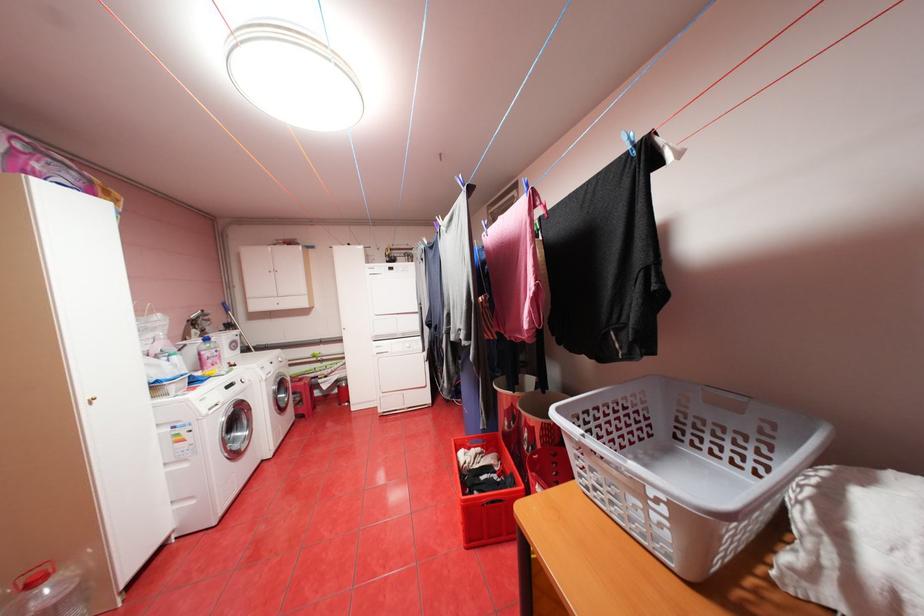
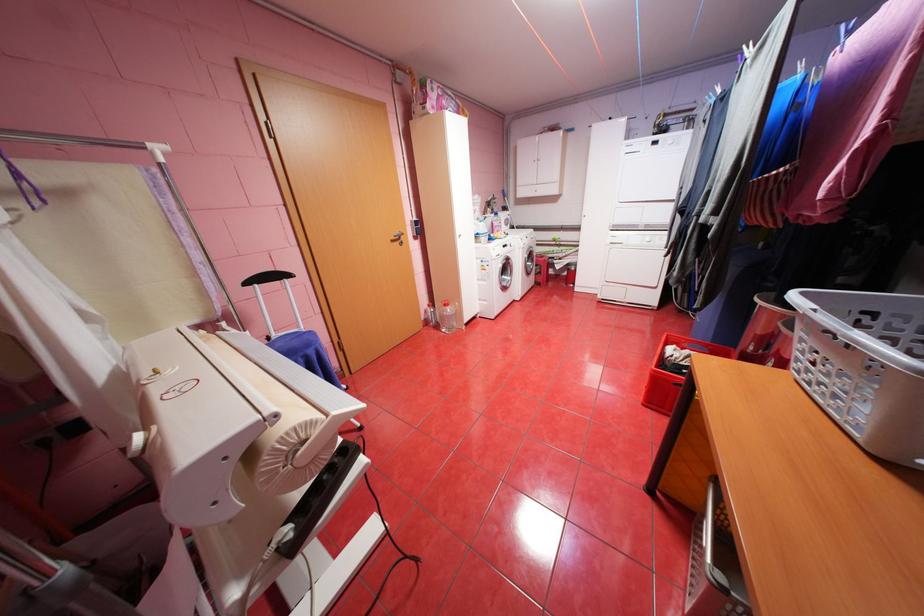
Find the pixel in the second image that matches (201,501) in the first image.

(494, 302)